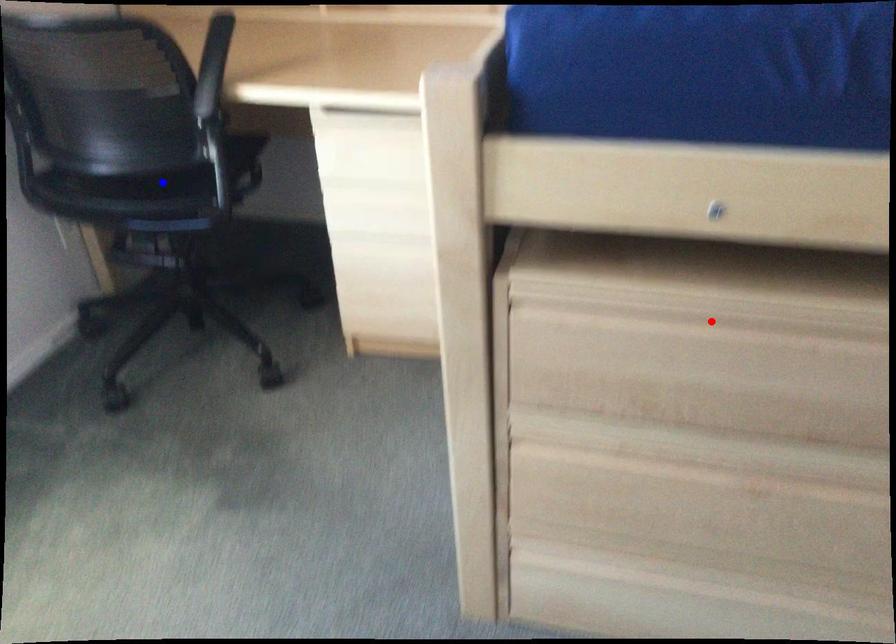
Question: Two points are marked on the image. Which point is closer to the camera?

Choices:
 (A) Blue point is closer.
 (B) Red point is closer.

Answer: (B)